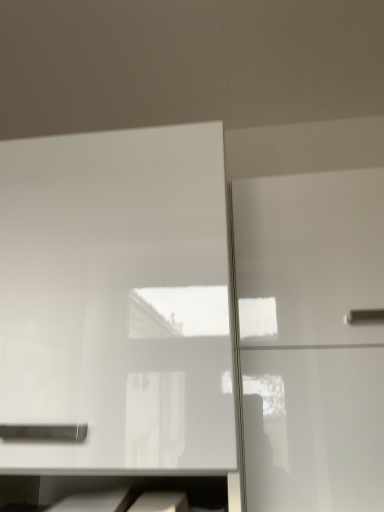
Question: Considering the relative sizes of glossy white cabinet at right, the 2th cabinetry when ordered from left to right, and white glossy cabinet at upper left, positioned as the 2th cabinetry in right-to-left order, in the image provided, is glossy white cabinet at right, the 2th cabinetry when ordered from left to right, smaller than white glossy cabinet at upper left, positioned as the 2th cabinetry in right-to-left order,?

Choices:
 (A) yes
 (B) no

Answer: (A)

Question: From the image's perspective, is glossy white cabinet at right, the 2th cabinetry when ordered from left to right, below white glossy cabinet at upper left, positioned as the 2th cabinetry in right-to-left order?

Choices:
 (A) yes
 (B) no

Answer: (A)

Question: From the image's perspective, would you say glossy white cabinet at right, which is counted as the 1th cabinetry, starting from the right, is positioned over white glossy cabinet at upper left, positioned as the 2th cabinetry in right-to-left order?

Choices:
 (A) yes
 (B) no

Answer: (B)

Question: Considering the relative positions of glossy white cabinet at right, the 2th cabinetry when ordered from left to right, and white glossy cabinet at upper left, the first cabinetry viewed from the left, in the image provided, is glossy white cabinet at right, the 2th cabinetry when ordered from left to right, to the right of white glossy cabinet at upper left, the first cabinetry viewed from the left, from the viewer's perspective?

Choices:
 (A) no
 (B) yes

Answer: (B)

Question: From a real-world perspective, is glossy white cabinet at right, which is counted as the 1th cabinetry, starting from the right, over white glossy cabinet at upper left, positioned as the 2th cabinetry in right-to-left order?

Choices:
 (A) no
 (B) yes

Answer: (B)

Question: Does glossy white cabinet at right, the 2th cabinetry when ordered from left to right, turn towards white glossy cabinet at upper left, positioned as the 2th cabinetry in right-to-left order?

Choices:
 (A) no
 (B) yes

Answer: (A)

Question: Would you say white glossy cabinet at upper left, positioned as the 2th cabinetry in right-to-left order, contains glossy white cabinet at right, the 2th cabinetry when ordered from left to right?

Choices:
 (A) yes
 (B) no

Answer: (B)

Question: From the image's perspective, is white glossy cabinet at upper left, positioned as the 2th cabinetry in right-to-left order, over glossy white cabinet at right, which is counted as the 1th cabinetry, starting from the right?

Choices:
 (A) yes
 (B) no

Answer: (A)

Question: Considering the relative sizes of white glossy cabinet at upper left, the first cabinetry viewed from the left, and glossy white cabinet at right, which is counted as the 1th cabinetry, starting from the right, in the image provided, is white glossy cabinet at upper left, the first cabinetry viewed from the left, bigger than glossy white cabinet at right, which is counted as the 1th cabinetry, starting from the right,?

Choices:
 (A) yes
 (B) no

Answer: (A)

Question: Is white glossy cabinet at upper left, positioned as the 2th cabinetry in right-to-left order, positioned with its back to glossy white cabinet at right, which is counted as the 1th cabinetry, starting from the right?

Choices:
 (A) no
 (B) yes

Answer: (A)

Question: Is white glossy cabinet at upper left, the first cabinetry viewed from the left, oriented towards glossy white cabinet at right, the 2th cabinetry when ordered from left to right?

Choices:
 (A) no
 (B) yes

Answer: (A)

Question: From a real-world perspective, is white glossy cabinet at upper left, the first cabinetry viewed from the left, located higher than glossy white cabinet at right, the 2th cabinetry when ordered from left to right?

Choices:
 (A) no
 (B) yes

Answer: (A)

Question: Is point (112, 338) positioned closer to the camera than point (306, 297)?

Choices:
 (A) closer
 (B) farther

Answer: (A)